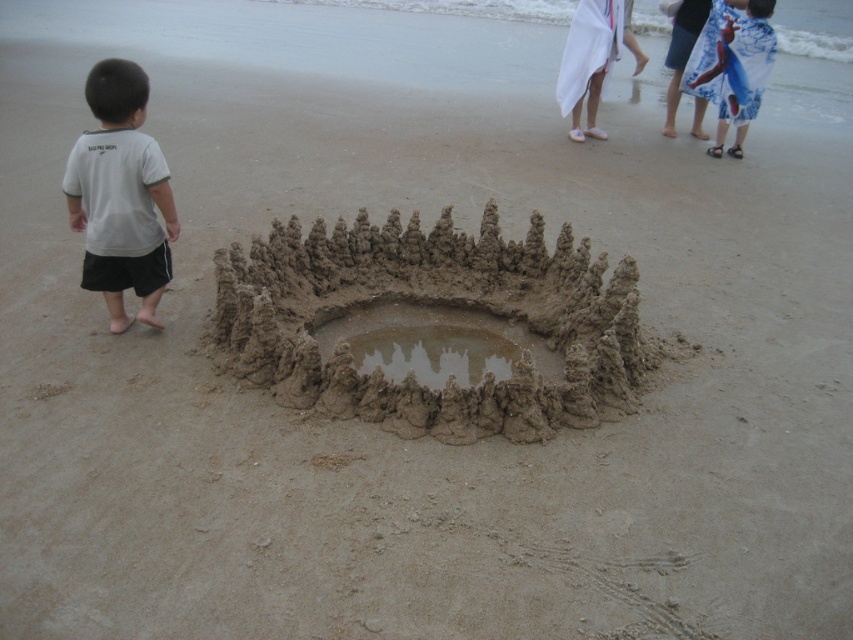
You are standing at point A located at coordinates point A at (119,276). You want to walk to point B, which is 3.87 meters away. Is this distance within a comfortable walking distance for a person?

Yes, the distance between point A at (119,276) and point B is 3.87 meters, which is a comfortable walking distance for a person.

You are a photographer standing at the beach scene. You want to capture both the sand sculpture and the person in the patterned outfit in your photo. The sand sculpture is located at point (529, 422) and the person is at point (717, 132). Which point is closer to your camera position?

Point (529, 422) is closer to the camera than point (717, 132), so you should ensure both are in frame by focusing on the closer point first.

You are a drone operator trying to capture the sand sculpture. You have a camera with a 10cm wide lens. The drone is currently positioned above the dry sandcastle at center. To get a clear shot of the sand sculpture, you need to move the camera 15cm to the right. Is this possible without moving the drone from its current position?

The dry sandcastle at center is located at point coordinates, so moving the camera 15cm to the right would require adjusting the camera angle or lens without needing to move the drone itself. This is possible as the adjustment is within the camera lens range.